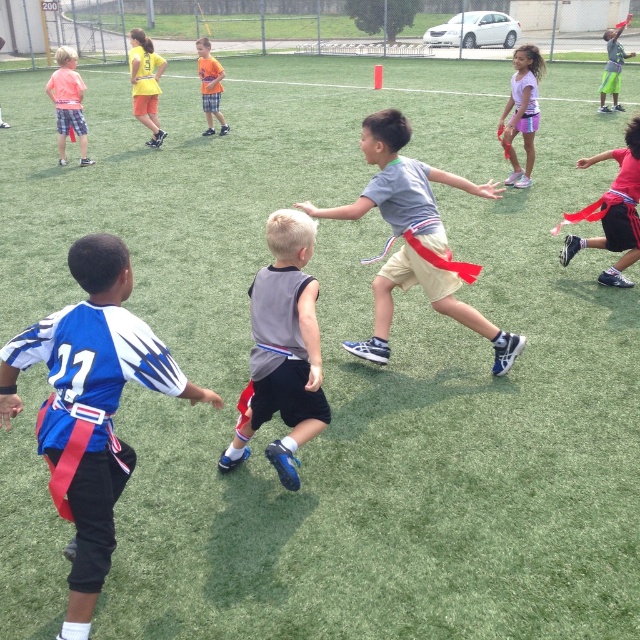
You are a player in the flag football game and you see the blue jersey at center and the red fabric flag at center. Which object is closer to you?

The blue jersey at center is closer to you because it is in front of the red fabric flag at center.